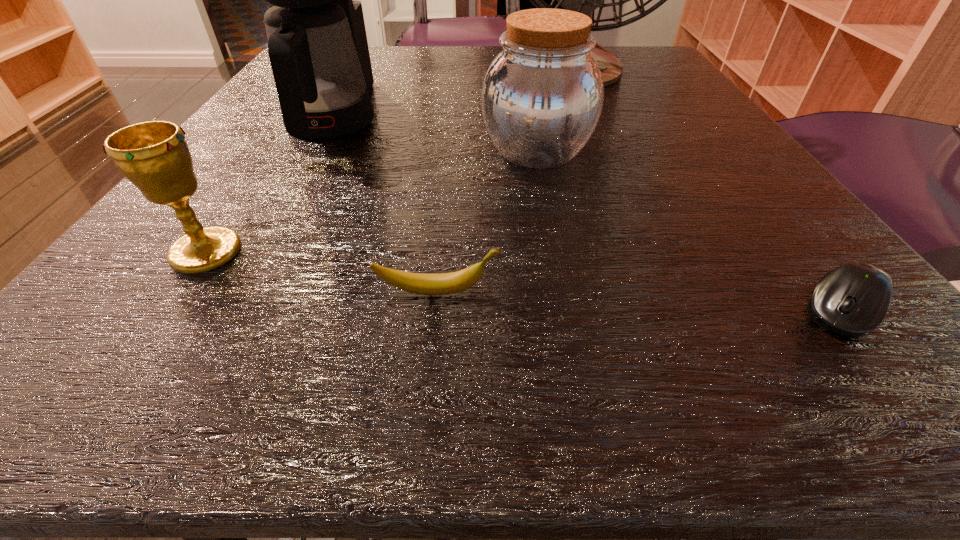
Find the location of a particular element. The height and width of the screenshot is (540, 960). object that is at the far left corner is located at coordinates (317, 44).

Identify the location of object at the far right corner. (585, 0).

Where is `object situated at the near right corner`? Image resolution: width=960 pixels, height=540 pixels. object situated at the near right corner is located at coordinates (851, 300).

Find the location of a particular element. The height and width of the screenshot is (540, 960). blank space at the far edge of the desktop is located at coordinates (439, 72).

This screenshot has height=540, width=960. In order to click on vacant space at the left edge of the desktop in this screenshot , I will do `click(278, 182)`.

Identify the location of vacant space at the right edge. The height and width of the screenshot is (540, 960). (672, 109).

Find the location of a particular element. This screenshot has height=540, width=960. vacant space at the near right corner of the desktop is located at coordinates (799, 327).

This screenshot has width=960, height=540. I want to click on unoccupied position between the tallest object and the coffee maker, so click(457, 91).

The height and width of the screenshot is (540, 960). Find the location of `free space that is in between the tallest object and the chalice`. free space that is in between the tallest object and the chalice is located at coordinates (393, 159).

Where is `empty space that is in between the second shortest object and the coffee maker`? empty space that is in between the second shortest object and the coffee maker is located at coordinates (385, 204).